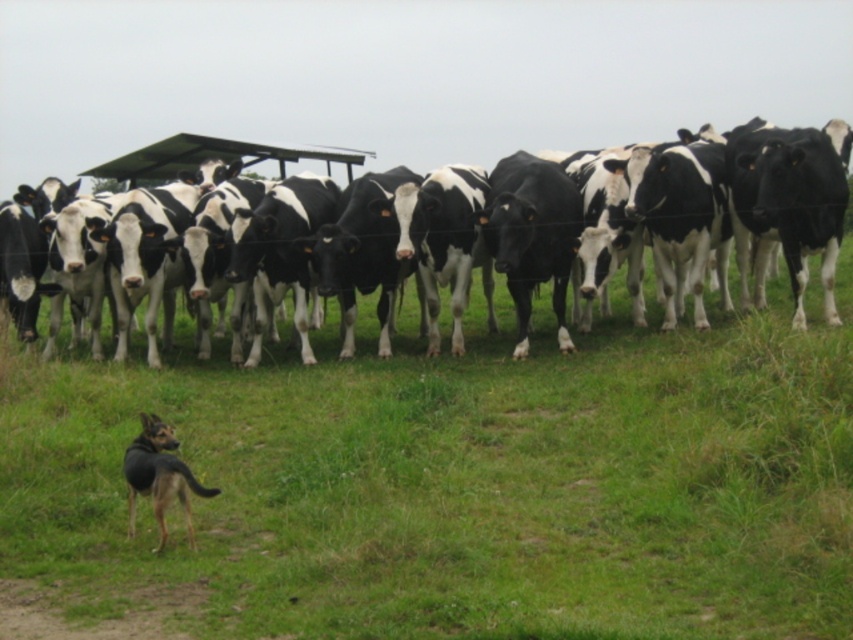
Question: Based on their relative distances, which object is farther from the green grass at lower center?

Choices:
 (A) black and white cows at center
 (B) brown fur dog at lower left

Answer: (A)

Question: Can you confirm if green grass at lower center is thinner than brown fur dog at lower left?

Choices:
 (A) yes
 (B) no

Answer: (B)

Question: Based on their relative distances, which object is farther from the brown fur dog at lower left?

Choices:
 (A) black and white cows at center
 (B) green grass at lower center

Answer: (A)

Question: In this image, where is green grass at lower center located relative to black and white cows at center?

Choices:
 (A) left
 (B) right

Answer: (B)

Question: Considering the relative positions of green grass at lower center and black and white cows at center in the image provided, where is green grass at lower center located with respect to black and white cows at center?

Choices:
 (A) below
 (B) above

Answer: (A)

Question: Among these points, which one is farthest from the camera?

Choices:
 (A) (x=672, y=604)
 (B) (x=198, y=236)

Answer: (B)